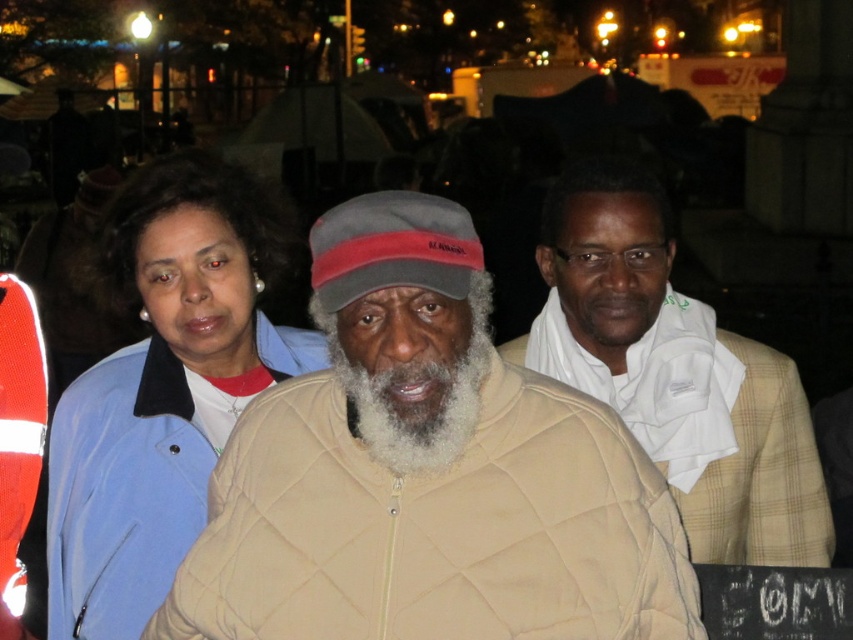
Can you confirm if blue quilted jacket at center is positioned above white fuzzy beard at center?

Incorrect, blue quilted jacket at center is not positioned above white fuzzy beard at center.

Is blue quilted jacket at center taller than white fuzzy beard at center?

Indeed, blue quilted jacket at center has a greater height compared to white fuzzy beard at center.

Locate an element on the screen. The height and width of the screenshot is (640, 853). blue quilted jacket at center is located at coordinates (164, 387).

Where is `blue quilted jacket at center`? blue quilted jacket at center is located at coordinates (164, 387).

Which of these two, tan quilted jacket at center or blue quilted jacket at center, stands taller?

Standing taller between the two is blue quilted jacket at center.

Between tan quilted jacket at center and blue quilted jacket at center, which one is positioned higher?

blue quilted jacket at center is higher up.

Locate an element on the screen. tan quilted jacket at center is located at coordinates (427, 474).

The width and height of the screenshot is (853, 640). Identify the location of tan quilted jacket at center. (427, 474).

Can you confirm if blue quilted jacket at center is shorter than white textured scarf at center?

No, blue quilted jacket at center is not shorter than white textured scarf at center.

Does point (264, 387) come in front of point (625, 413)?

No, it is not.

Is point (154, 371) positioned in front of point (584, 381)?

That is False.

Locate an element on the screen. This screenshot has height=640, width=853. blue quilted jacket at center is located at coordinates (164, 387).